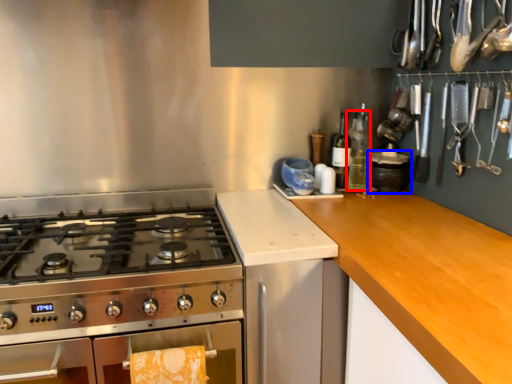
Question: Which object is closer to the camera taking this photo, bottle (highlighted by a red box) or kitchen appliance (highlighted by a blue box)?

Choices:
 (A) bottle
 (B) kitchen appliance

Answer: (B)